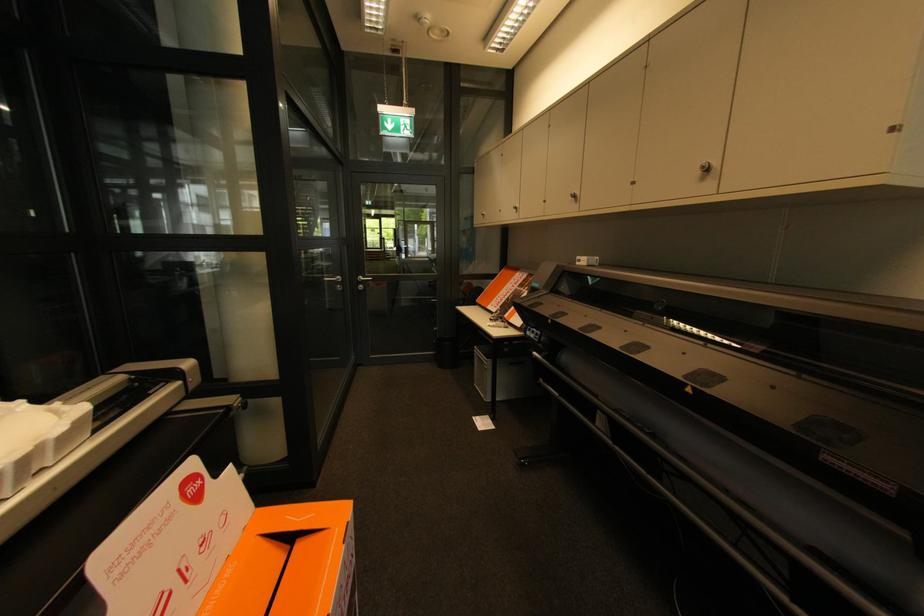
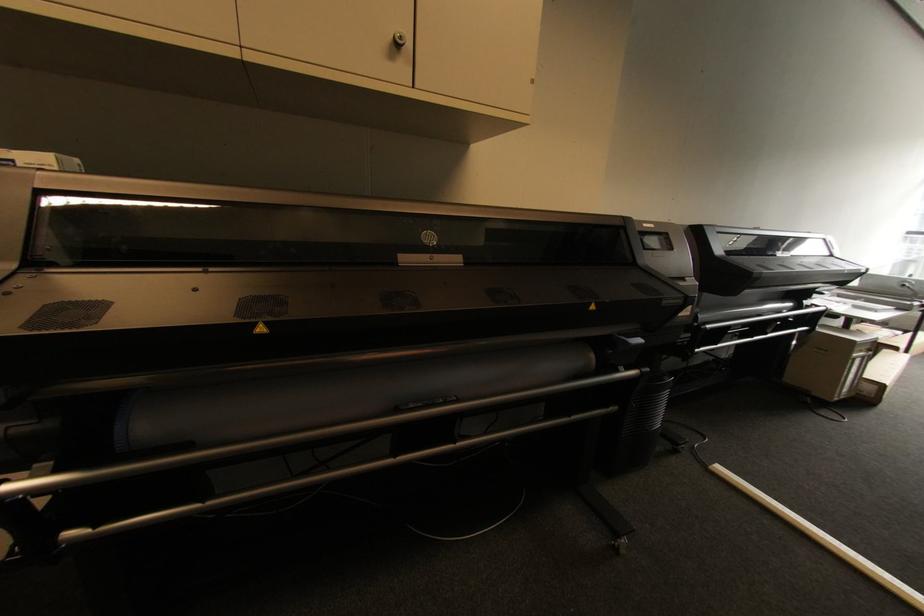
The point at [707,168] is marked in the first image. Where is the corresponding point in the second image?

(405, 38)